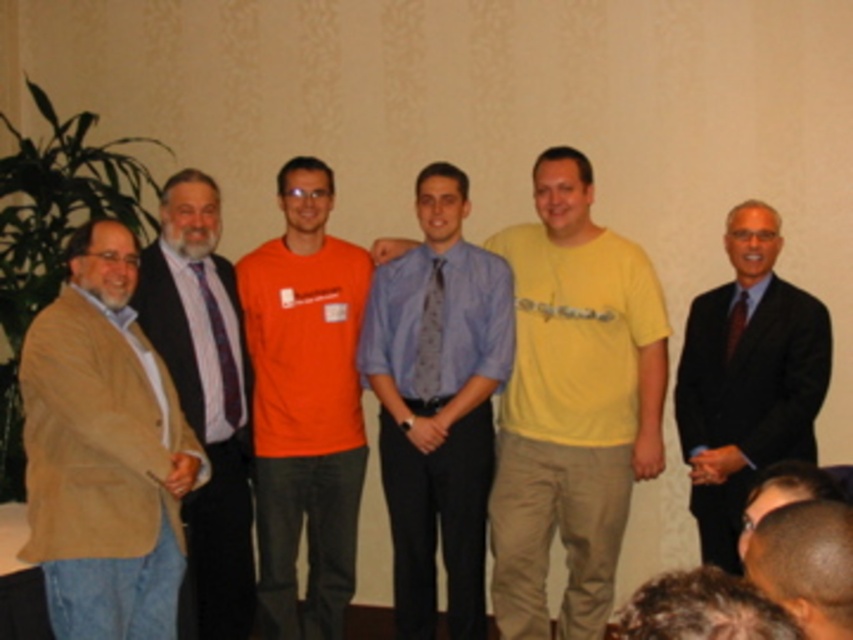
Does orange t-shirt at center have a greater height compared to striped silk tie at left?

Correct, orange t-shirt at center is much taller as striped silk tie at left.

Is point (343, 493) closer to camera compared to point (236, 413)?

No, (343, 493) is behind (236, 413).

Measure the distance between point (302, 336) and camera.

3.91 meters

Where is `orange t-shirt at center`? orange t-shirt at center is located at coordinates (305, 404).

Is dark blue suit at center smaller than shiny black hair at lower right?

Actually, dark blue suit at center might be larger than shiny black hair at lower right.

Is dark blue suit at center to the right of shiny black hair at lower right from the viewer's perspective?

Correct, you'll find dark blue suit at center to the right of shiny black hair at lower right.

The image size is (853, 640). Describe the element at coordinates (747, 380) in the screenshot. I see `dark blue suit at center` at that location.

The width and height of the screenshot is (853, 640). What are the coordinates of `dark blue suit at center` in the screenshot? It's located at (747, 380).

Which of these two, matte black suit at left or shiny black hair at lower right, stands shorter?

shiny black hair at lower right

Can you confirm if matte black suit at left is positioned above shiny black hair at lower right?

Correct, matte black suit at left is located above shiny black hair at lower right.

The height and width of the screenshot is (640, 853). What do you see at coordinates (206, 392) in the screenshot?
I see `matte black suit at left` at bounding box center [206, 392].

The width and height of the screenshot is (853, 640). Identify the location of matte black suit at left. (206, 392).